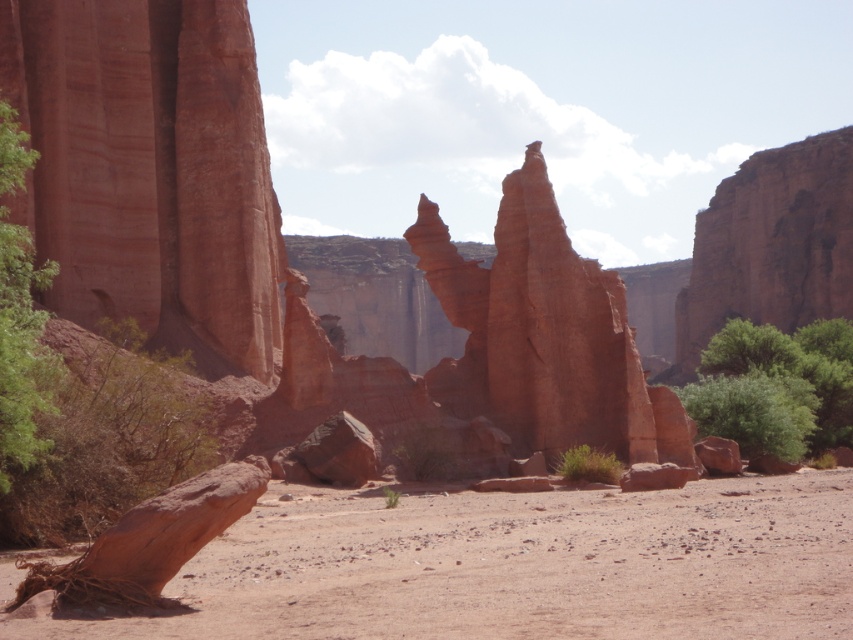
You are a hiker who wants to take a photo of the smooth sandstone rock formation at center and the green leafy bush at lower left. From your current position, which object should you look towards first to capture both in the same frame?

The smooth sandstone rock formation at center is located above the green leafy bush at lower left, so you should aim your camera upwards to include both in the frame.